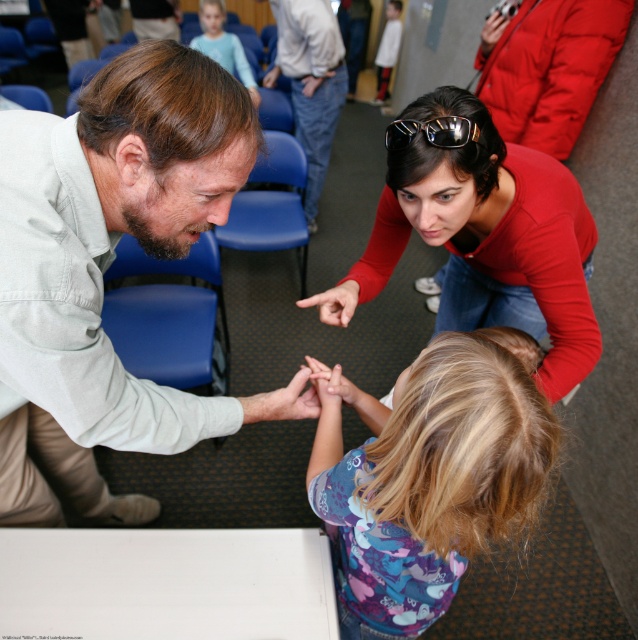
Question: Which point is farther to the camera?

Choices:
 (A) (276, 13)
 (B) (165, 170)
 (C) (521, 266)
 (D) (449, 138)

Answer: (A)

Question: Does black plastic sunglasses at upper center appear over white cotton shirt at upper center?

Choices:
 (A) yes
 (B) no

Answer: (B)

Question: Is light blue shirt at upper center to the right of white cotton shirt at upper center from the viewer's perspective?

Choices:
 (A) yes
 (B) no

Answer: (B)

Question: Which point is closer to the camera?

Choices:
 (A) red matte shirt at upper center
 (B) light blue jeans at center
 (C) white cotton shirt at upper center

Answer: (A)

Question: Which point is farther to the camera?

Choices:
 (A) purple cotton shirt at lower center
 (B) light blue shirt at upper center

Answer: (B)

Question: Does purple cotton shirt at lower center come in front of black plastic sunglasses at upper center?

Choices:
 (A) yes
 (B) no

Answer: (A)